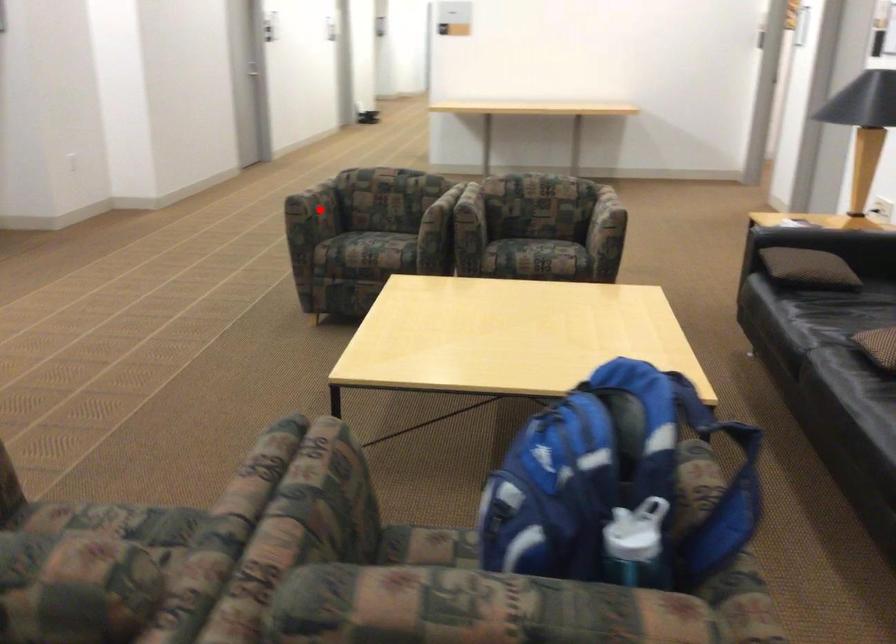
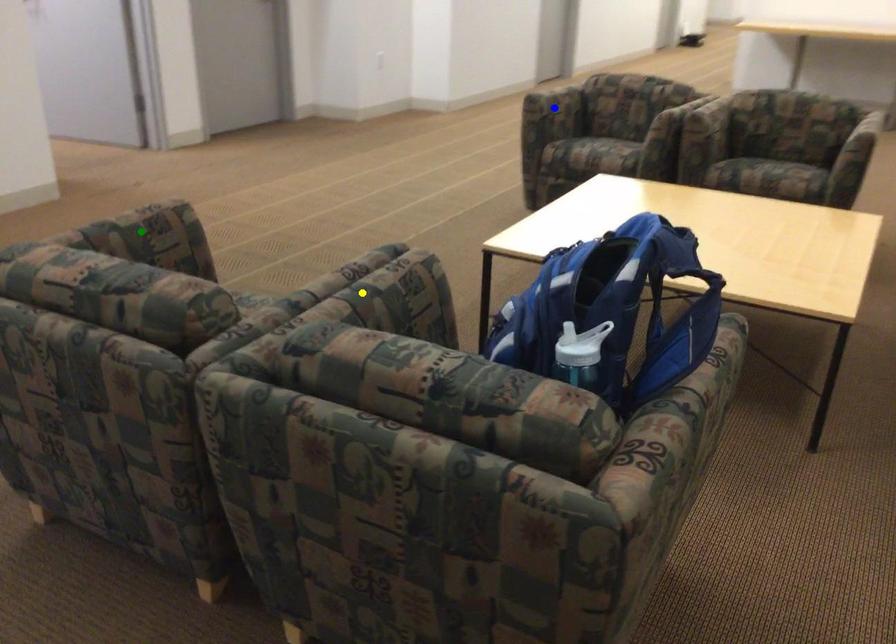
Question: I am providing you with two images of the same scene from different viewpoints. A red point is marked on the first image. You are given multiple points on the second image. In image 2, which mark is for the same physical point as the one in image 1?

Choices:
 (A) yellow point
 (B) blue point
 (C) green point

Answer: (B)